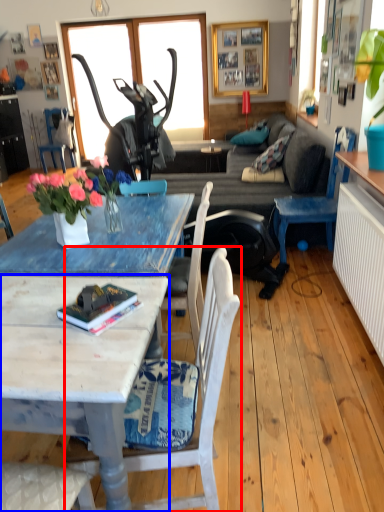
Question: Which object is closer to the camera taking this photo, chair (highlighted by a red box) or coffee table (highlighted by a blue box)?

Choices:
 (A) chair
 (B) coffee table

Answer: (B)